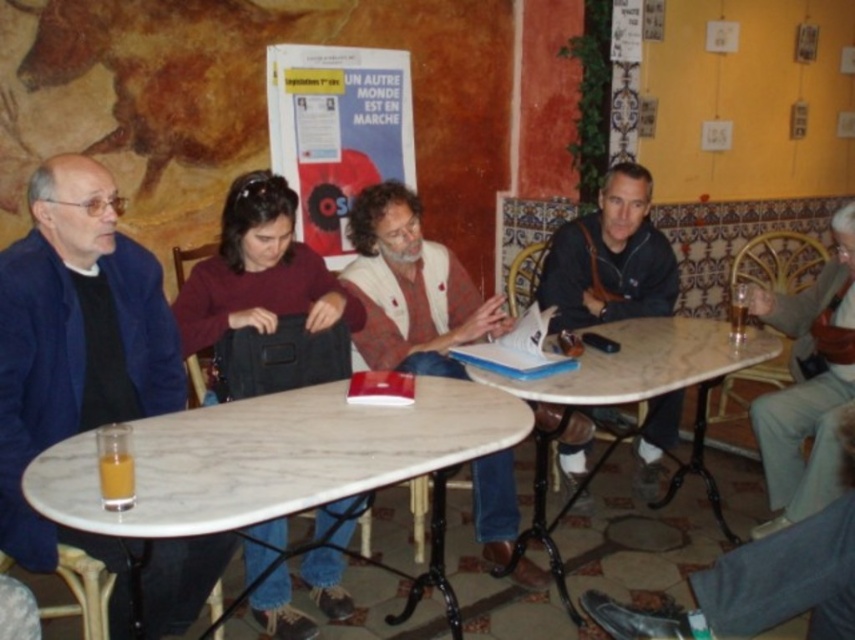
You are a barista preparing to place a large tray of coffee cups on the white marble table at center. The tray is as wide as the black leather jacket at center. Will the tray fit on the table?

The white marble table at center is wider than the black leather jacket at center, so the tray, which is as wide as the jacket, will fit on the table.